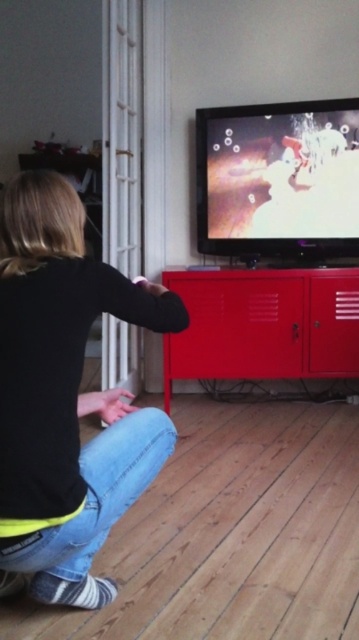
You are designing a layout for a living room and need to ensure that the black matte shirt at lower left and the metallic red cabinet at center are visible from the entrance. Given their sizes, which object might require strategic placement to ensure visibility?

The black matte shirt at lower left has a lesser width compared to the metallic red cabinet at center, so it might need to be placed in a more prominent position to ensure visibility from the entrance.

You are a photographer trying to capture a clear shot of the metallic red cabinet at center without the black matte shirt at lower left blocking it. What should you do?

The black matte shirt at lower left is in front of the metallic red cabinet at center, so to avoid blocking the cabinet, move your camera position to the side or behind the shirt.

You are a photographer setting up a shoot in the room. You need to position a light source so that it illuminates the black matte shirt at lower left without casting a shadow from the metallic red cabinet at center. Is this possible based on their positions?

The black matte shirt at lower left is below the metallic red cabinet at center, so positioning a light source above the cabinet would cast a shadow over the shirt. To avoid this, the light should be placed below the cabinet, but since the shirt is already below, it might still be in shadow. Alternatively, using multiple lights or diffusers could help minimize shadows, but based on their vertical positions alone, it may not be possible without shadows.